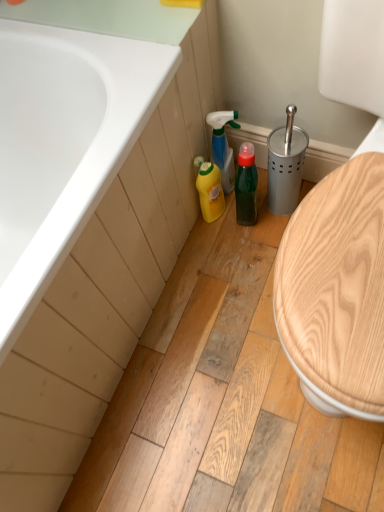
Question: From the image's perspective, is white glossy bathtub at upper left beneath green matte bottle at center?

Choices:
 (A) yes
 (B) no

Answer: (A)

Question: Can you confirm if white glossy bathtub at upper left is positioned to the right of green matte bottle at center?

Choices:
 (A) no
 (B) yes

Answer: (A)

Question: Does white glossy bathtub at upper left have a smaller size compared to green matte bottle at center?

Choices:
 (A) no
 (B) yes

Answer: (A)

Question: Does white glossy bathtub at upper left have a lesser height compared to green matte bottle at center?

Choices:
 (A) yes
 (B) no

Answer: (B)

Question: Is the depth of white glossy bathtub at upper left greater than that of green matte bottle at center?

Choices:
 (A) no
 (B) yes

Answer: (A)

Question: From a real-world perspective, is white glossy bathtub at upper left physically located above or below green matte bottle at center?

Choices:
 (A) below
 (B) above

Answer: (B)

Question: Based on their sizes in the image, would you say white glossy bathtub at upper left is bigger or smaller than green matte bottle at center?

Choices:
 (A) small
 (B) big

Answer: (B)

Question: Considering the positions of point (150, 83) and point (253, 185), is point (150, 83) closer or farther from the camera than point (253, 185)?

Choices:
 (A) farther
 (B) closer

Answer: (B)

Question: Considering the positions of white glossy bathtub at upper left and green matte bottle at center in the image, is white glossy bathtub at upper left wider or thinner than green matte bottle at center?

Choices:
 (A) wide
 (B) thin

Answer: (A)

Question: From a real-world perspective, is white glossy bathtub at upper left above or below translucent green spray bottle at center, the first cleaning product positioned from the top?

Choices:
 (A) below
 (B) above

Answer: (B)

Question: Is white glossy bathtub at upper left inside or outside of translucent green spray bottle at center, the first cleaning product positioned from the top?

Choices:
 (A) outside
 (B) inside

Answer: (A)

Question: Visually, is white glossy bathtub at upper left positioned to the left or to the right of translucent green spray bottle at center, the 2th cleaning product in the bottom-to-top sequence?

Choices:
 (A) left
 (B) right

Answer: (A)

Question: Is white glossy bathtub at upper left bigger or smaller than translucent green spray bottle at center, the 2th cleaning product in the bottom-to-top sequence?

Choices:
 (A) small
 (B) big

Answer: (B)

Question: Relative to yellow plastic bottle at lower center, the 2th cleaning product when ordered from top to bottom, is green matte bottle at center in front or behind?

Choices:
 (A) front
 (B) behind

Answer: (A)

Question: From a real-world perspective, relative to yellow plastic bottle at lower center, the 1th cleaning product from the bottom, is green matte bottle at center vertically above or below?

Choices:
 (A) above
 (B) below

Answer: (A)